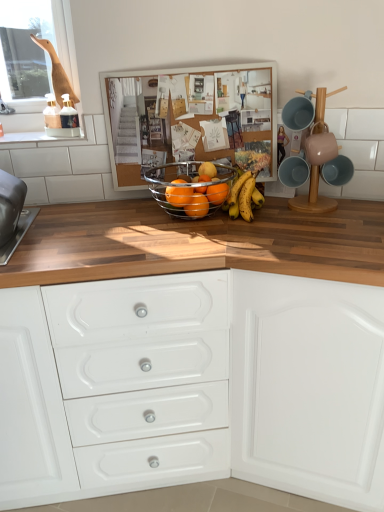
Question: From a real-world perspective, is metallic orange fruit at center, the 3th orange from the right, over metallic wire basket at center?

Choices:
 (A) yes
 (B) no

Answer: (B)

Question: Is metallic orange fruit at center, placed as the 2th orange when sorted from left to right, far from metallic wire basket at center?

Choices:
 (A) yes
 (B) no

Answer: (B)

Question: From the image's perspective, does metallic orange fruit at center, placed as the 2th orange when sorted from left to right, appear lower than metallic wire basket at center?

Choices:
 (A) no
 (B) yes

Answer: (B)

Question: Is metallic orange fruit at center, the 3th orange from the right, positioned before metallic wire basket at center?

Choices:
 (A) yes
 (B) no

Answer: (B)

Question: Can you confirm if metallic orange fruit at center, the 3th orange from the right, is positioned to the right of metallic wire basket at center?

Choices:
 (A) no
 (B) yes

Answer: (B)

Question: Is metallic orange fruit at center, the 3th orange from the right, shorter than metallic wire basket at center?

Choices:
 (A) yes
 (B) no

Answer: (A)

Question: Is the position of glossy metallic fruit basket at center, acting as the fourth orange starting from the right, more distant than that of matte blue cup at upper right?

Choices:
 (A) yes
 (B) no

Answer: (A)

Question: Considering the relative sizes of glossy metallic fruit basket at center, marked as the 1th orange in a left-to-right arrangement, and matte blue cup at upper right in the image provided, is glossy metallic fruit basket at center, marked as the 1th orange in a left-to-right arrangement, thinner than matte blue cup at upper right?

Choices:
 (A) yes
 (B) no

Answer: (A)

Question: Is matte blue cup at upper right completely or partially inside glossy metallic fruit basket at center, marked as the 1th orange in a left-to-right arrangement?

Choices:
 (A) no
 (B) yes

Answer: (A)

Question: Considering the relative sizes of glossy metallic fruit basket at center, acting as the fourth orange starting from the right, and matte blue cup at upper right in the image provided, is glossy metallic fruit basket at center, acting as the fourth orange starting from the right, smaller than matte blue cup at upper right?

Choices:
 (A) yes
 (B) no

Answer: (A)

Question: Is glossy metallic fruit basket at center, marked as the 1th orange in a left-to-right arrangement, bigger than matte blue cup at upper right?

Choices:
 (A) yes
 (B) no

Answer: (B)

Question: Does glossy metallic fruit basket at center, marked as the 1th orange in a left-to-right arrangement, have a lesser height compared to matte blue cup at upper right?

Choices:
 (A) no
 (B) yes

Answer: (B)

Question: Does glossy orange at center, which is the first orange from right to left, have a greater height compared to glossy metallic fruit basket at center, marked as the 1th orange in a left-to-right arrangement?

Choices:
 (A) no
 (B) yes

Answer: (B)